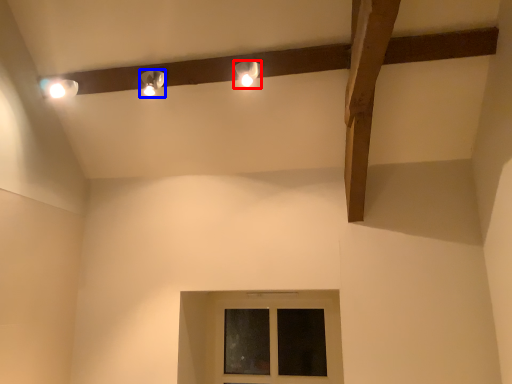
Question: Which object appears farthest to the camera in this image, lamp (highlighted by a red box) or lamp (highlighted by a blue box)?

Choices:
 (A) lamp
 (B) lamp

Answer: (B)